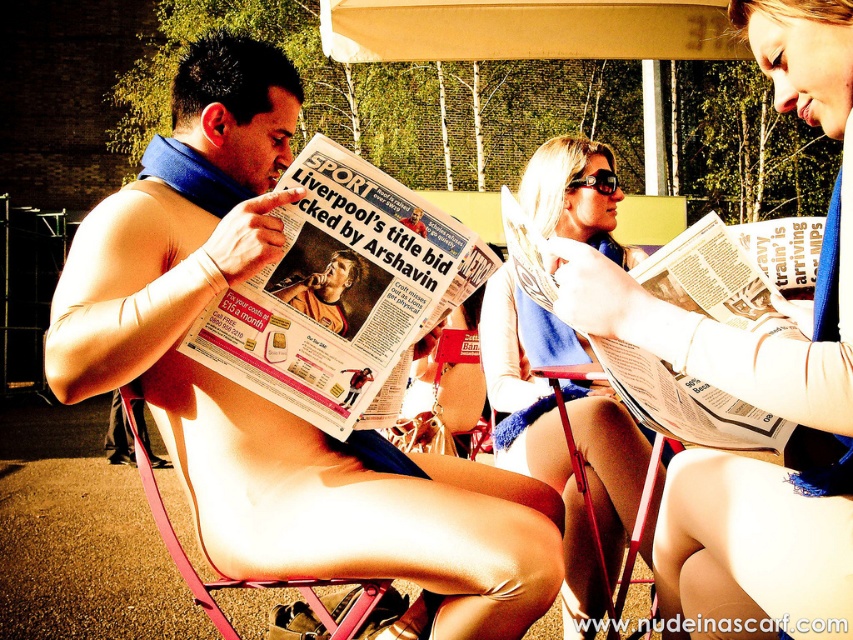
Between blue fabric scarf at center and black plastic goggles at upper center, which one is positioned lower?

Positioned lower is blue fabric scarf at center.

The height and width of the screenshot is (640, 853). What do you see at coordinates (538, 426) in the screenshot?
I see `blue fabric scarf at center` at bounding box center [538, 426].

Identify the location of blue fabric scarf at center. (538, 426).

Does point (119, 387) come closer to viewer compared to point (299, 298)?

That is True.

Which of these two, pink plastic beach chair at lower center or matte newspaper at center, stands taller?

Standing taller between the two is pink plastic beach chair at lower center.

What do you see at coordinates (242, 579) in the screenshot? I see `pink plastic beach chair at lower center` at bounding box center [242, 579].

At what (x,y) coordinates should I click in order to perform the action: click on pink plastic beach chair at lower center. Please return your answer as a coordinate pair (x, y). Image resolution: width=853 pixels, height=640 pixels. Looking at the image, I should click on (242, 579).

Which is below, blue fabric scarf at upper center or matte newspaper at center?

blue fabric scarf at upper center is lower down.

Is point (674, 557) less distant than point (311, 307)?

That is True.

The image size is (853, 640). I want to click on blue fabric scarf at upper center, so click(776, 300).